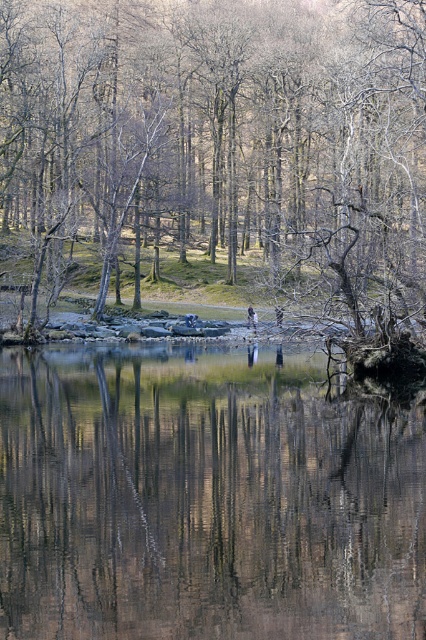
Question: Which point is closer to the camera?

Choices:
 (A) transparent water at center
 (B) brown matte tree at center

Answer: (A)

Question: Is brown matte tree at center wider than transparent water at center?

Choices:
 (A) no
 (B) yes

Answer: (B)

Question: Is brown matte tree at center in front of transparent water at center?

Choices:
 (A) no
 (B) yes

Answer: (A)

Question: Does brown matte tree at center have a larger size compared to transparent water at center?

Choices:
 (A) yes
 (B) no

Answer: (A)

Question: Which object appears closest to the camera in this image?

Choices:
 (A) brown matte tree at center
 (B) transparent water at center

Answer: (B)